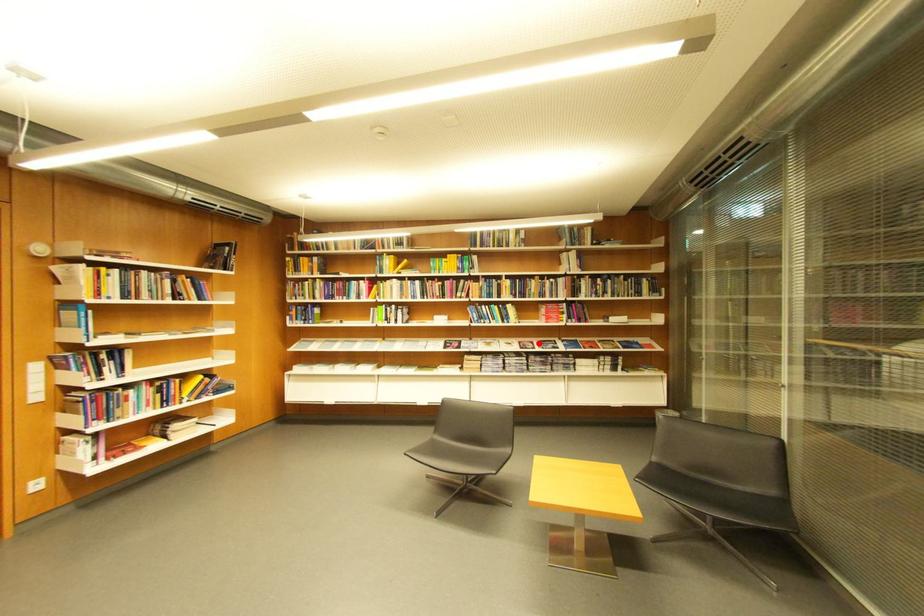
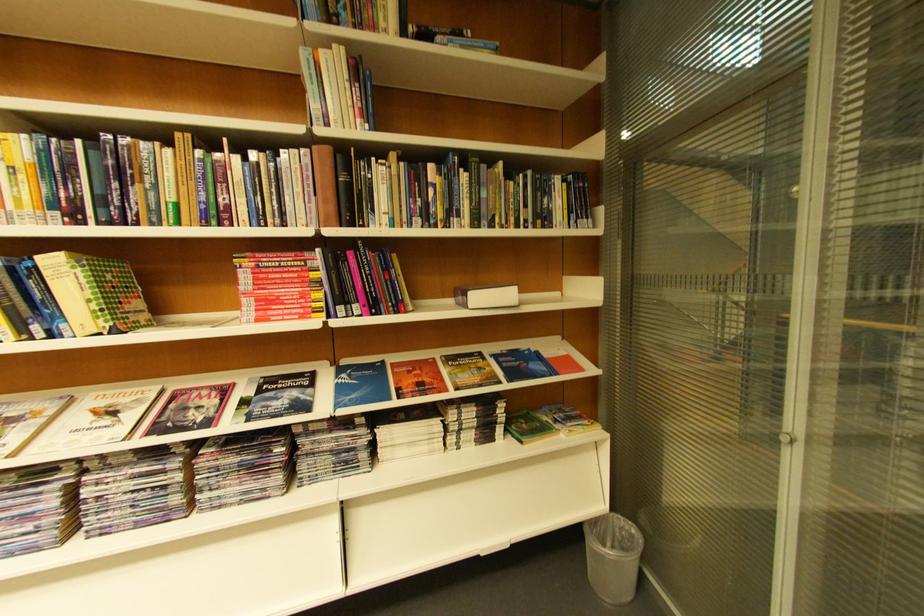
Locate, in the second image, the point that corresponds to the highlighted location in the first image.

(224, 389)